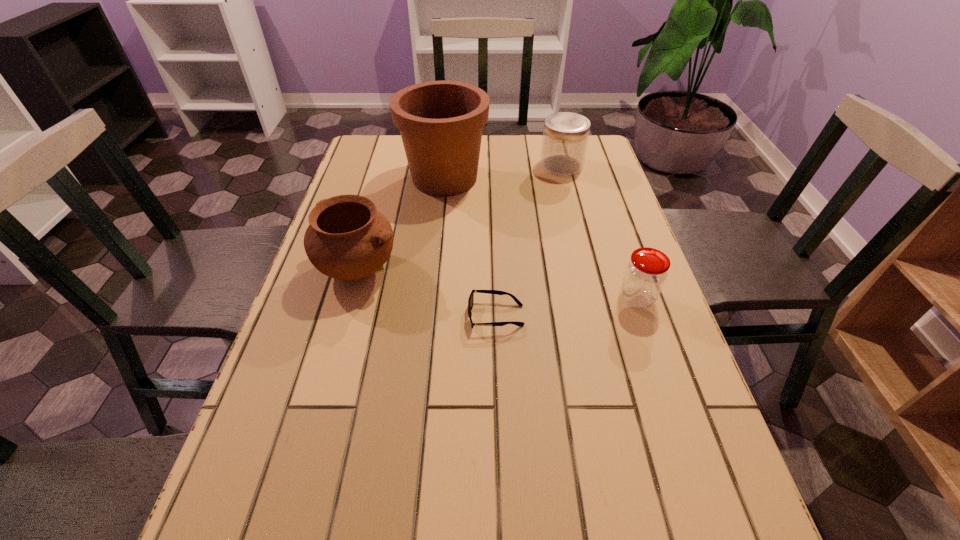
Locate an element on the screen. flowerpot is located at coordinates (441, 122).

Identify the location of pottery. (347, 238).

This screenshot has height=540, width=960. Identify the location of the farther jar. (565, 137).

Identify the location of the nearer jar. This screenshot has height=540, width=960. (646, 272).

Locate an element on the screen. This screenshot has height=540, width=960. the shorter jar is located at coordinates (646, 272).

Identify the location of sunglasses. The image size is (960, 540). (471, 298).

Find the location of a particular element. Image resolution: width=960 pixels, height=540 pixels. vacant region located 0.340m on the right of the tallest object is located at coordinates (601, 178).

Identify the location of free point located 0.180m on the back of the pottery. (378, 201).

Image resolution: width=960 pixels, height=540 pixels. I want to click on vacant space located 0.330m on the left of the farther jar, so click(x=435, y=165).

Image resolution: width=960 pixels, height=540 pixels. I want to click on free location located 0.210m on the front of the nearer jar, so click(x=671, y=401).